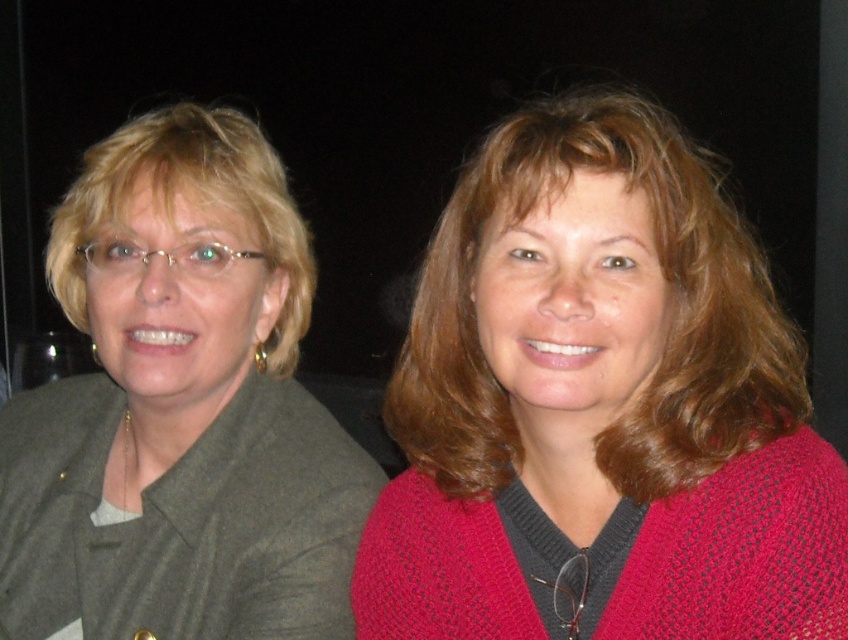
Question: Is knitted pink sweater at center thinner than matte gray blazer at left?

Choices:
 (A) yes
 (B) no

Answer: (B)

Question: Which object is closer to the camera taking this photo?

Choices:
 (A) knitted pink sweater at center
 (B) matte gray blazer at left

Answer: (A)

Question: Does knitted pink sweater at center appear under matte gray blazer at left?

Choices:
 (A) no
 (B) yes

Answer: (B)

Question: Which of the following is the closest to the observer?

Choices:
 (A) (703, 280)
 (B) (18, 422)

Answer: (A)

Question: Does knitted pink sweater at center lie behind matte gray blazer at left?

Choices:
 (A) yes
 (B) no

Answer: (B)